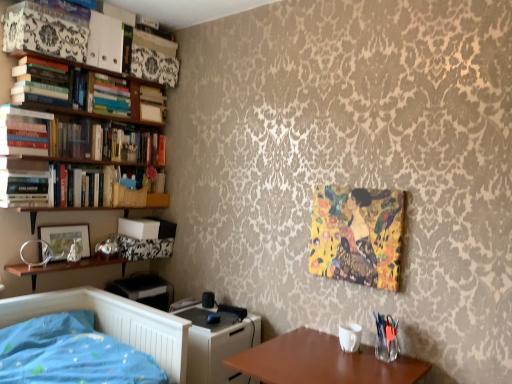
Where is `hardcover book at left, which appears as the first book when ordered from the bottom`? hardcover book at left, which appears as the first book when ordered from the bottom is located at coordinates (24, 188).

What is the approximate height of hardcover book at left, which appears as the first book when ordered from the bottom?

9.82 inches.

Image resolution: width=512 pixels, height=384 pixels. What do you see at coordinates (24, 131) in the screenshot?
I see `hardcover books at left, the 4th book positioned from the top` at bounding box center [24, 131].

You are a GUI agent. You are given a task and a screenshot of the screen. Output one action in this format:
    pyautogui.click(x=<x>, y=<y>)
    Task: Click on the metallic silver picture frame at left
    Image resolution: width=512 pixels, height=384 pixels.
    Given the screenshot: What is the action you would take?
    tap(65, 238)

Measure the distance between point (87,82) and camera.

Point (87,82) is 2.43 meters from camera.

Image resolution: width=512 pixels, height=384 pixels. In order to click on hardcover book at left, the sixth book positioned from the top in this screenshot , I will do `click(24, 188)`.

Is matte wood shelf at upper left not close to wooden table at lower right?

That's right, there is a large distance between matte wood shelf at upper left and wooden table at lower right.

Based on the photo, from the image's perspective, between matte wood shelf at upper left and wooden table at lower right, which one is located above?

matte wood shelf at upper left, from the image's perspective.

Is matte wood shelf at upper left situated inside wooden table at lower right or outside?

matte wood shelf at upper left is not inside wooden table at lower right, it's outside.

Considering the relative sizes of hardcover books at left, placed as the 5th book when sorted from top to bottom, and white plastic/file cabinet at lower center in the image provided, is hardcover books at left, placed as the 5th book when sorted from top to bottom, smaller than white plastic/file cabinet at lower center?

Indeed, hardcover books at left, placed as the 5th book when sorted from top to bottom, has a smaller size compared to white plastic/file cabinet at lower center.

The image size is (512, 384). I want to click on the 2nd book above the white plastic/file cabinet at lower center (from the image's perspective), so click(98, 139).

Which object is positioned more to the left, hardcover books at left, which is the 2th book in bottom-to-top order, or white plastic/file cabinet at lower center?

hardcover books at left, which is the 2th book in bottom-to-top order.

Choose the correct answer: Is hardcover books at left, which is the 2th book in bottom-to-top order, inside white plastic/file cabinet at lower center or outside it?

hardcover books at left, which is the 2th book in bottom-to-top order, is located beyond the bounds of white plastic/file cabinet at lower center.

From a real-world perspective, which object stands above the other?

From a 3D spatial view, hardcover books at left, the 4th book positioned from the top, is above.

Which is more to the right, white plastic/file cabinet at lower center or hardcover books at left, the 4th book positioned from the top?

From the viewer's perspective, white plastic/file cabinet at lower center appears more on the right side.

In the image, there is a hardcover books at left, the 4th book positioned from the top. Where is `file cabinet below it (from a real-world perspective)`? The image size is (512, 384). file cabinet below it (from a real-world perspective) is located at coordinates (218, 345).

Can you confirm if hardcover book at left, which appears as the first book when ordered from the bottom, is positioned to the left of wooden table at lower right?

Yes, hardcover book at left, which appears as the first book when ordered from the bottom, is to the left of wooden table at lower right.

From the image's perspective, is hardcover book at left, the sixth book positioned from the top, above wooden table at lower right?

Yes.

In the image, is hardcover book at left, which appears as the first book when ordered from the bottom, positioned in front of or behind wooden table at lower right?

hardcover book at left, which appears as the first book when ordered from the bottom, is positioned farther from the viewer than wooden table at lower right.

Considering the sizes of objects hardcover book at left, the sixth book positioned from the top, and wooden table at lower right in the image provided, who is smaller, hardcover book at left, the sixth book positioned from the top, or wooden table at lower right?

hardcover book at left, the sixth book positioned from the top, is smaller.

How much distance is there between matte wood shelf at upper left and hardcover book at left, the sixth book positioned from the top?

matte wood shelf at upper left is 31.13 inches from hardcover book at left, the sixth book positioned from the top.

From the image's perspective, is matte wood shelf at upper left located above or below hardcover book at left, which appears as the first book when ordered from the bottom?

From the image's perspective, matte wood shelf at upper left appears above hardcover book at left, which appears as the first book when ordered from the bottom.

Which of these two, matte wood shelf at upper left or hardcover book at left, which appears as the first book when ordered from the bottom, is bigger?

With larger size is hardcover book at left, which appears as the first book when ordered from the bottom.

Where is `book that is the 4th one below the matte wood shelf at upper left (from a real-world perspective)`? book that is the 4th one below the matte wood shelf at upper left (from a real-world perspective) is located at coordinates (24, 188).

Which object is thinner, hardcover books at upper left, the 6th book when ordered from bottom to top, or hardcover books at left, placed as the 5th book when sorted from top to bottom?

With smaller width is hardcover books at left, placed as the 5th book when sorted from top to bottom.

Is point (109, 100) closer or farther from the camera than point (78, 139)?

Point (109, 100) appears to be farther away from the viewer than point (78, 139).

Considering the relative positions of hardcover books at upper left, which ranks as the 1th book in top-to-bottom order, and hardcover books at left, placed as the 5th book when sorted from top to bottom, in the image provided, is hardcover books at upper left, which ranks as the 1th book in top-to-bottom order, to the left or to the right of hardcover books at left, placed as the 5th book when sorted from top to bottom,?

In the image, hardcover books at upper left, which ranks as the 1th book in top-to-bottom order, appears on the left side of hardcover books at left, placed as the 5th book when sorted from top to bottom.

From a real-world perspective, which object rests below the other?

hardcover books at left, which is the 2th book in bottom-to-top order, is physically lower.

Is metallic silver picture frame at left looking in the opposite direction of hardcover books at upper left, acting as the 3th book starting from the top?

metallic silver picture frame at left is not turned away from hardcover books at upper left, acting as the 3th book starting from the top.

Considering the relative positions of metallic silver picture frame at left and hardcover books at upper left, acting as the 3th book starting from the top, in the image provided, is metallic silver picture frame at left behind hardcover books at upper left, acting as the 3th book starting from the top,?

→ No, metallic silver picture frame at left is closer to the camera.

From the image's perspective, which one is positioned lower, metallic silver picture frame at left or hardcover books at upper left, which is the fourth book from bottom to top?

metallic silver picture frame at left is shown below in the image.

Can you confirm if metallic silver picture frame at left is bigger than hardcover books at upper left, which is the fourth book from bottom to top?

Actually, metallic silver picture frame at left might be smaller than hardcover books at upper left, which is the fourth book from bottom to top.

Where is `shelf behind the wooden table at lower right`? shelf behind the wooden table at lower right is located at coordinates (145, 102).

Image resolution: width=512 pixels, height=384 pixels. Identify the location of file cabinet below the hardcover books at left, placed as the 5th book when sorted from top to bottom (from a real-world perspective). (218, 345).

When comparing their distances from metallic silver picture frame at left, does hardcover books at upper left, which is the fourth book from bottom to top, or matte wood shelf at upper left seem closer?

Based on the image, hardcover books at upper left, which is the fourth book from bottom to top, appears to be nearer to metallic silver picture frame at left.

Based on their spatial positions, is hardcover book at left, which appears as the first book when ordered from the bottom, or hardcover books at upper left, which ranks as the 1th book in top-to-bottom order, closer to metallic silver picture frame at left?

Based on the image, hardcover book at left, which appears as the first book when ordered from the bottom, appears to be nearer to metallic silver picture frame at left.

Looking at the image, which one is located closer to hardcover books at left, the 4th book positioned from the top, hardcover books at left, marked as the fifth book in a bottom-to-top arrangement, or hardcover books at upper left, the 6th book when ordered from bottom to top?

hardcover books at left, marked as the fifth book in a bottom-to-top arrangement, is positioned closer to the anchor hardcover books at left, the 4th book positioned from the top.

From the image, which object appears to be nearer to hardcover books at upper left, the 6th book when ordered from bottom to top, matte wood shelf at upper left or metallic silver picture frame at left?

matte wood shelf at upper left.

Based on their spatial positions, is hardcover book at left, which appears as the first book when ordered from the bottom, or hardcover books at left, which is the 2th book in bottom-to-top order, further from hardcover books at left, which is counted as the 3th book, starting from the bottom?

hardcover books at left, which is the 2th book in bottom-to-top order, lies further to hardcover books at left, which is counted as the 3th book, starting from the bottom, than the other object.

Which object lies nearer to the anchor point hardcover books at upper left, the 6th book when ordered from bottom to top, hardcover books at left, marked as the fifth book in a bottom-to-top arrangement, or hardcover books at upper left, acting as the 3th book starting from the top?

Based on the image, hardcover books at upper left, acting as the 3th book starting from the top, appears to be nearer to hardcover books at upper left, the 6th book when ordered from bottom to top.

When comparing their distances from hardcover books at left, which is counted as the 3th book, starting from the bottom, does matte wood shelf at upper left or white plastic/file cabinet at lower center seem further?

white plastic/file cabinet at lower center is positioned further to the anchor hardcover books at left, which is counted as the 3th book, starting from the bottom.

When comparing their distances from hardcover books at left, placed as the 5th book when sorted from top to bottom, does hardcover books at upper left, which ranks as the 1th book in top-to-bottom order, or hardcover books at left, which appears as the second book when viewed from the top, seem further?

hardcover books at left, which appears as the second book when viewed from the top.

The height and width of the screenshot is (384, 512). What are the coordinates of `file cabinet situated between hardcover books at left, the 4th book positioned from the top, and wooden table at lower right from left to right` in the screenshot? It's located at [x=218, y=345].

The image size is (512, 384). In order to click on picture frame between hardcover book at left, the sixth book positioned from the top, and wooden table at lower right, in the horizontal direction in this screenshot , I will do `click(65, 238)`.

The width and height of the screenshot is (512, 384). In order to click on picture frame that lies between matte wood shelf at upper left and wooden table at lower right from top to bottom in this screenshot , I will do `click(65, 238)`.

Locate an element on the screen. The width and height of the screenshot is (512, 384). shelf between hardcover books at left, the 4th book positioned from the top, and wooden table at lower right is located at coordinates (145, 102).